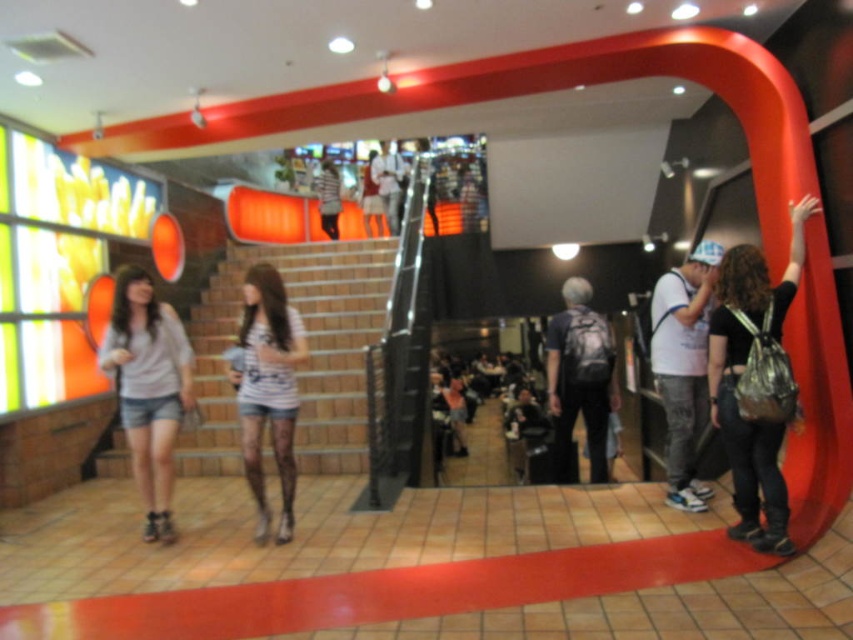
Question: Is brown brick stairs at center above denim shorts at left?

Choices:
 (A) no
 (B) yes

Answer: (B)

Question: Can you confirm if black matte backpack at right is smaller than denim shorts at left?

Choices:
 (A) no
 (B) yes

Answer: (A)

Question: Which object is farther from the camera taking this photo?

Choices:
 (A) gray fabric backpack at center
 (B) denim shorts at left
 (C) white striped shirt at center
 (D) white cotton shirt at center

Answer: (A)

Question: Which of the following is the closest to the observer?

Choices:
 (A) (213, 440)
 (B) (149, 522)
 (C) (601, 364)
 (D) (749, 332)

Answer: (D)

Question: Which object is farther from the camera taking this photo?

Choices:
 (A) black matte backpack at right
 (B) white striped shirt at center

Answer: (B)

Question: Can you confirm if denim shorts at left is positioned above gray fabric backpack at center?

Choices:
 (A) no
 (B) yes

Answer: (B)